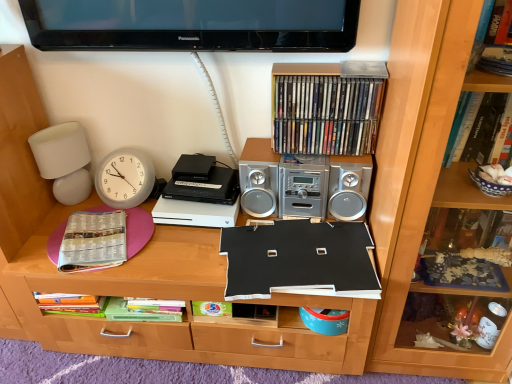
Question: Are white paper at left, the 2th paperback book positioned from the right, and black matte paper at center, the second paperback book from the left, located far from each other?

Choices:
 (A) yes
 (B) no

Answer: (B)

Question: Does white paper at left, acting as the 1th paperback book starting from the left, have a greater height compared to black matte paper at center, arranged as the 1th paperback book when viewed from the right?

Choices:
 (A) yes
 (B) no

Answer: (B)

Question: Can you confirm if white paper at left, acting as the 1th paperback book starting from the left, is thinner than black matte paper at center, arranged as the 1th paperback book when viewed from the right?

Choices:
 (A) no
 (B) yes

Answer: (B)

Question: Could black matte paper at center, the second paperback book from the left, be considered to be inside white paper at left, acting as the 1th paperback book starting from the left?

Choices:
 (A) no
 (B) yes

Answer: (A)

Question: From the image's perspective, is white paper at left, acting as the 1th paperback book starting from the left, below black matte paper at center, the second paperback book from the left?

Choices:
 (A) no
 (B) yes

Answer: (A)

Question: Which is correct: silver metallic stereo at upper center is inside wooden bookcase at right, or outside of it?

Choices:
 (A) inside
 (B) outside

Answer: (B)

Question: Does point (335, 190) appear closer or farther from the camera than point (397, 362)?

Choices:
 (A) farther
 (B) closer

Answer: (A)

Question: Is silver metallic stereo at upper center taller or shorter than wooden bookcase at right?

Choices:
 (A) short
 (B) tall

Answer: (A)

Question: From the image's perspective, is silver metallic stereo at upper center positioned above or below wooden bookcase at right?

Choices:
 (A) above
 (B) below

Answer: (A)

Question: Considering the relative positions of black matte paper at center, arranged as the 1th paperback book when viewed from the right, and black matte board at center in the image provided, is black matte paper at center, arranged as the 1th paperback book when viewed from the right, to the left or to the right of black matte board at center?

Choices:
 (A) left
 (B) right

Answer: (B)

Question: Considering the positions of point (265, 246) and point (243, 327), is point (265, 246) closer or farther from the camera than point (243, 327)?

Choices:
 (A) farther
 (B) closer

Answer: (B)

Question: Based on their sizes in the image, would you say black matte paper at center, arranged as the 1th paperback book when viewed from the right, is bigger or smaller than black matte board at center?

Choices:
 (A) big
 (B) small

Answer: (B)

Question: Is black matte paper at center, the second paperback book from the left, taller or shorter than black matte board at center?

Choices:
 (A) short
 (B) tall

Answer: (A)

Question: In terms of size, does black plastic cassette at center appear bigger or smaller than white paper at left, acting as the 1th paperback book starting from the left?

Choices:
 (A) small
 (B) big

Answer: (B)

Question: Looking at their shapes, would you say black plastic cassette at center is wider or thinner than white paper at left, the 2th paperback book positioned from the right?

Choices:
 (A) thin
 (B) wide

Answer: (A)